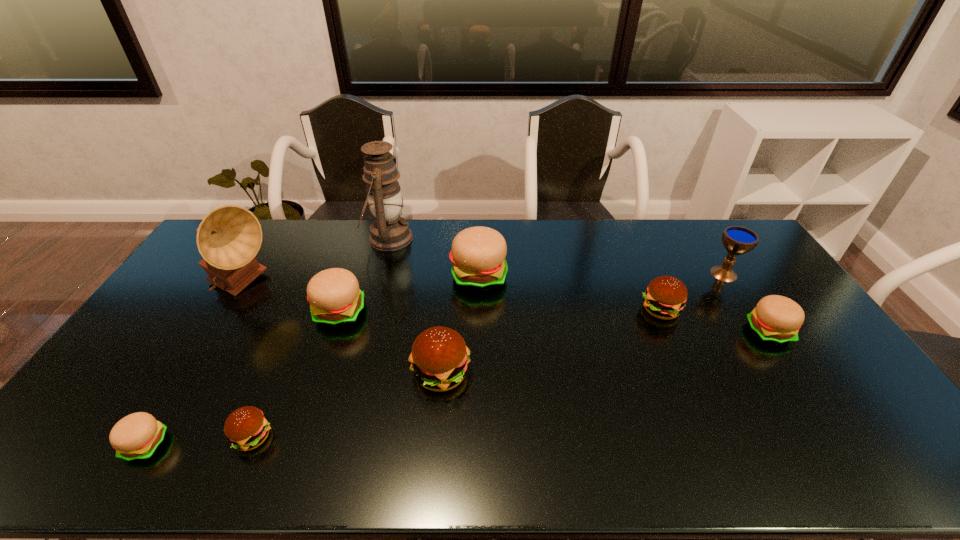
At what (x,y) coordinates should I click in order to perform the action: click on the rightmost brown hamburger. Please return your answer as a coordinate pair (x, y). Looking at the image, I should click on (665, 297).

What are the coordinates of `the second smallest beige hamburger` in the screenshot? It's located at (776, 319).

The width and height of the screenshot is (960, 540). I want to click on the rightmost hamburger, so click(x=776, y=319).

I want to click on the nearest brown hamburger, so click(x=246, y=428).

I want to click on the smallest brown hamburger, so tap(246, 428).

Where is `the leftmost beige hamburger`? The height and width of the screenshot is (540, 960). the leftmost beige hamburger is located at coordinates (137, 436).

This screenshot has width=960, height=540. I want to click on the smallest beige hamburger, so point(137,436).

Find the location of `vacant position located 0.140m on the left of the brown oil lamp`. vacant position located 0.140m on the left of the brown oil lamp is located at coordinates (328, 238).

At what (x,y) coordinates should I click in order to perform the action: click on vacant region located 0.200m on the horn of the ninth shortest object. Please return your answer as a coordinate pair (x, y). The image size is (960, 540). Looking at the image, I should click on (338, 286).

Locate an element on the screen. The height and width of the screenshot is (540, 960). vacant space located on the left of the farthest hamburger is located at coordinates (370, 276).